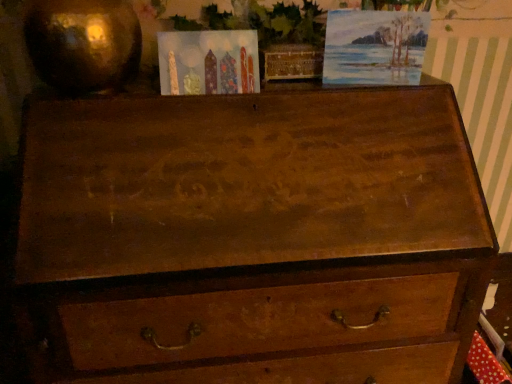
Find the location of a particular element. vacant area to the right of matte paper postcard at upper center is located at coordinates (294, 90).